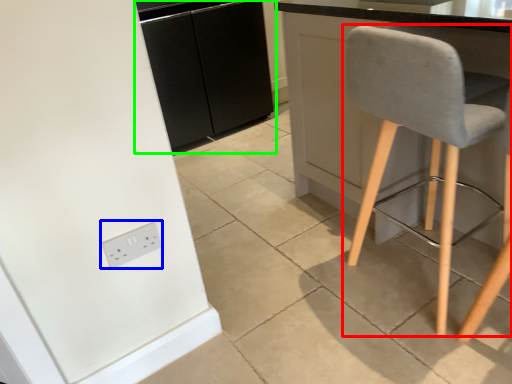
Question: Which is farther away from chair (highlighted by a red box)? socket (highlighted by a blue box) or cabinetry (highlighted by a green box)?

Choices:
 (A) socket
 (B) cabinetry

Answer: (B)